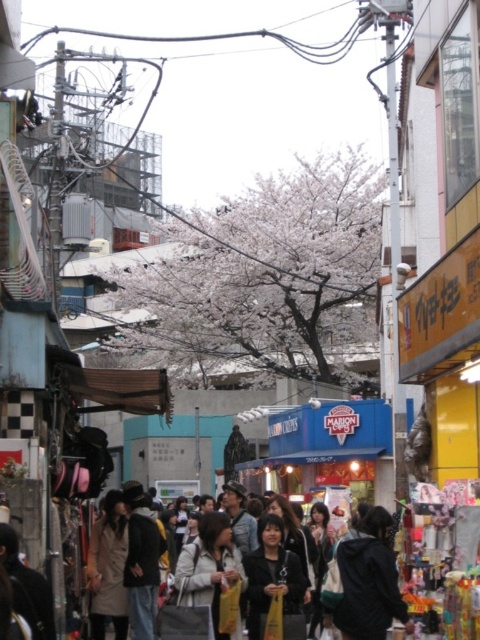
Question: From the image, what is the correct spatial relationship of dark gray hoodie at center in relation to light beige jacket at center?

Choices:
 (A) above
 (B) below

Answer: (A)

Question: Does dark gray hoodie at center have a lesser width compared to light beige jacket at center?

Choices:
 (A) yes
 (B) no

Answer: (B)

Question: Considering the real-world distances, which object is closest to the dark gray fabric crowd at center?

Choices:
 (A) dark gray hoodie at center
 (B) light beige jacket at center

Answer: (A)

Question: From the image, what is the correct spatial relationship of dark gray fabric crowd at center in relation to light beige jacket at center?

Choices:
 (A) above
 (B) below

Answer: (A)

Question: Which object is the closest to the light beige jacket at center?

Choices:
 (A) dark gray fabric crowd at center
 (B) dark gray hoodie at center

Answer: (A)

Question: Among these points, which one is farthest from the camera?

Choices:
 (A) (354, 616)
 (B) (214, 602)
 (C) (370, 611)

Answer: (B)